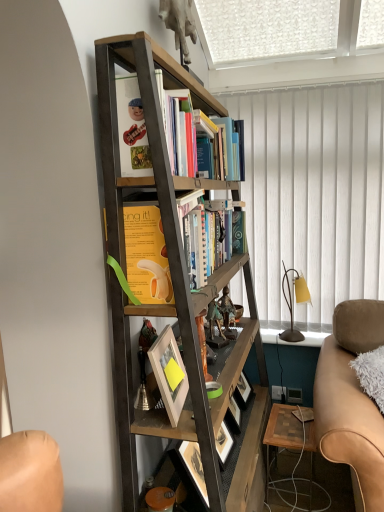
Question: From their relative heights in the image, would you say wooden/matte table at lower right is taller or shorter than white matte picture frame at center?

Choices:
 (A) tall
 (B) short

Answer: (A)

Question: From the image's perspective, is wooden/matte table at lower right positioned above or below white matte picture frame at center?

Choices:
 (A) below
 (B) above

Answer: (A)

Question: Which object is positioned closest to the suede tan couch at lower right?

Choices:
 (A) white textured curtain at upper right
 (B) wooden/matte table at lower right
 (C) white matte picture frame at center
 (D) hardcover books at center, the 1th book in the back-to-front sequence
 (E) brown matte table lamp at right

Answer: (B)

Question: Which object is positioned closest to the white matte picture frame at center?

Choices:
 (A) white textured curtain at upper right
 (B) wooden/matte table at lower right
 (C) yellow paperback book at center, positioned as the 3th book in back-to-front order
 (D) suede tan couch at lower right
 (E) metallic figurine at center, arranged as the second toy when viewed from the front

Answer: (C)